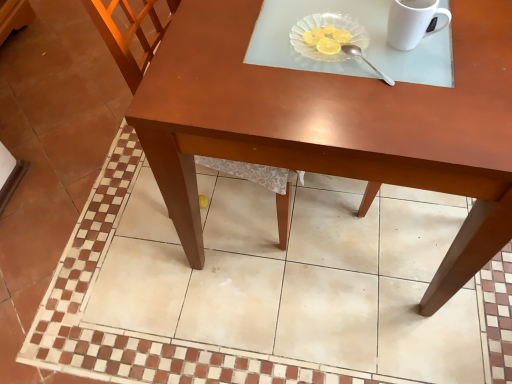
Locate an element on the screen. This screenshot has height=384, width=512. free location to the right of transparent glass plate at upper center is located at coordinates (408, 48).